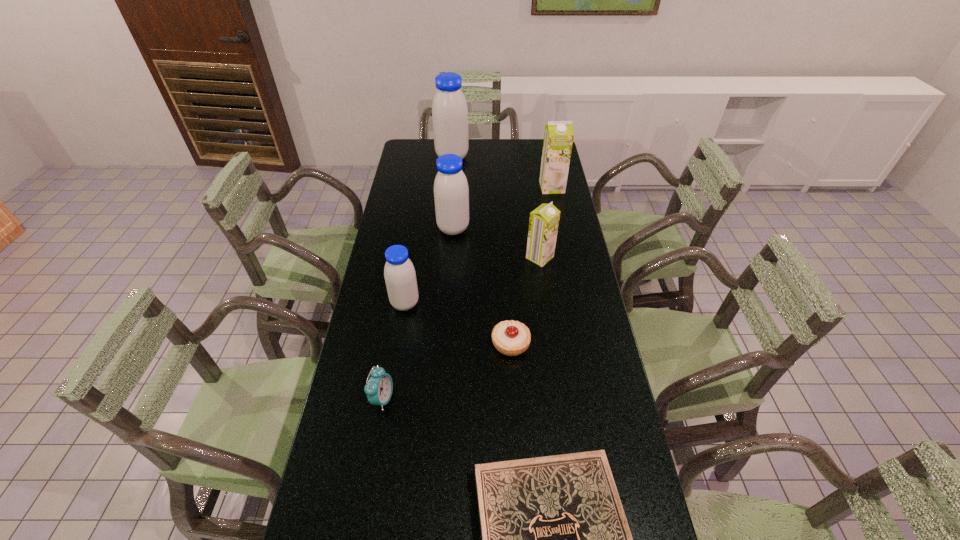
Locate an element on the screen. The height and width of the screenshot is (540, 960). blue soya milk that is the closest to the farthest blue soya milk is located at coordinates (451, 192).

Identify the location of free space that satisfies the following two spatial constraints: 1. on the front side of the sixth nearest object; 2. on the face of the third shortest object. The width and height of the screenshot is (960, 540). (442, 399).

This screenshot has height=540, width=960. Find the location of `free space that satisfies the following two spatial constraints: 1. on the front side of the bigger green soya milk; 2. on the face of the second nearest object`. free space that satisfies the following two spatial constraints: 1. on the front side of the bigger green soya milk; 2. on the face of the second nearest object is located at coordinates (595, 399).

Where is `vacant area that satisfies the following two spatial constraints: 1. on the front side of the third nearest object; 2. on the right side of the nearest soya milk`? The image size is (960, 540). vacant area that satisfies the following two spatial constraints: 1. on the front side of the third nearest object; 2. on the right side of the nearest soya milk is located at coordinates (398, 344).

Image resolution: width=960 pixels, height=540 pixels. Identify the location of free space in the image that satisfies the following two spatial constraints: 1. on the back side of the nearer green soya milk; 2. on the left side of the nearest blue soya milk. (413, 258).